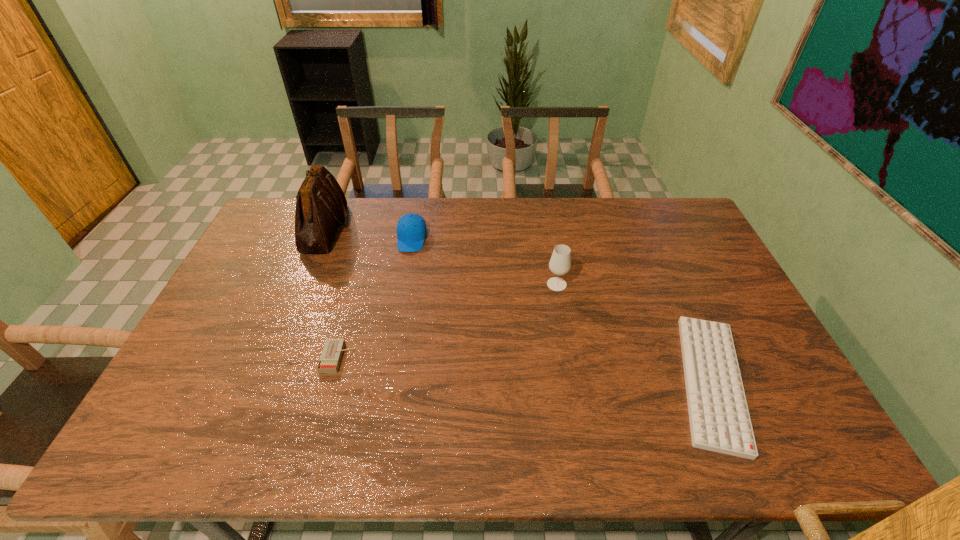
The height and width of the screenshot is (540, 960). Identify the location of vacant area situated on the front-facing side of the third object from left to right. (397, 321).

Where is `vacant space situated on the striking surface of the matchbox`? vacant space situated on the striking surface of the matchbox is located at coordinates (372, 358).

Where is `vacant space located on the back of the computer keyboard`? vacant space located on the back of the computer keyboard is located at coordinates (663, 271).

In order to click on shoulder bag positioned at the far edge in this screenshot , I will do `click(321, 205)`.

Identify the location of cap present at the far edge. (411, 229).

Identify the location of object that is at the near edge. The width and height of the screenshot is (960, 540). (719, 418).

In order to click on object present at the left edge in this screenshot , I will do `click(321, 205)`.

What are the coordinates of `object at the right edge` in the screenshot? It's located at coord(719,418).

The width and height of the screenshot is (960, 540). What are the coordinates of `object at the far left corner` in the screenshot? It's located at (321, 205).

This screenshot has height=540, width=960. Identify the location of object located in the near right corner section of the desktop. (719, 418).